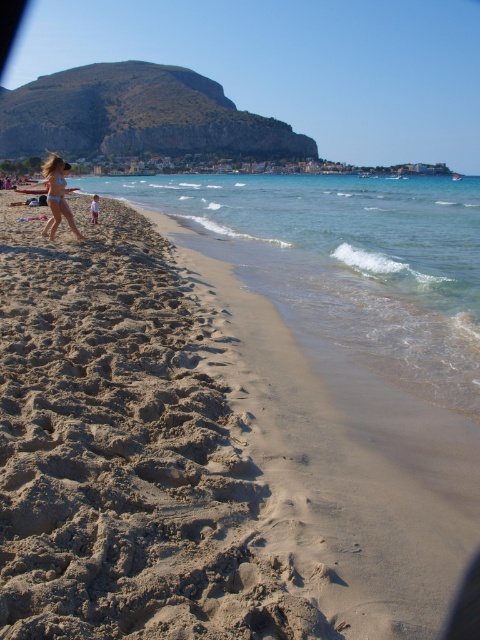
Question: Does golden sand beach at left lie in front of white matte bikini at left?

Choices:
 (A) no
 (B) yes

Answer: (B)

Question: Which point is farther to the camera?

Choices:
 (A) (54, 179)
 (B) (94, 220)

Answer: (B)

Question: Which object is positioned closest to the matte bikini at left?

Choices:
 (A) clear blue water at lower left
 (B) golden sand beach at left

Answer: (B)

Question: Which of the following is the farthest from the observer?

Choices:
 (A) beige sand at lower left
 (B) white matte bikini at left
 (C) clear blue water at lower left

Answer: (A)

Question: Observing the image, what is the correct spatial positioning of matte bikini at left in reference to white matte bikini at left?

Choices:
 (A) left
 (B) right

Answer: (A)

Question: Is clear blue water at lower left bigger than matte bikini at left?

Choices:
 (A) yes
 (B) no

Answer: (A)